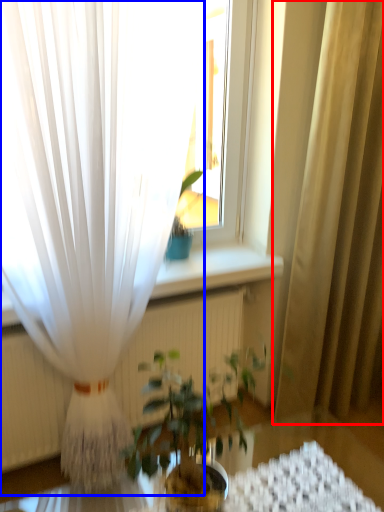
Question: Which of the following is the closest to the observer, curtain (highlighted by a red box) or curtain (highlighted by a blue box)?

Choices:
 (A) curtain
 (B) curtain

Answer: (B)